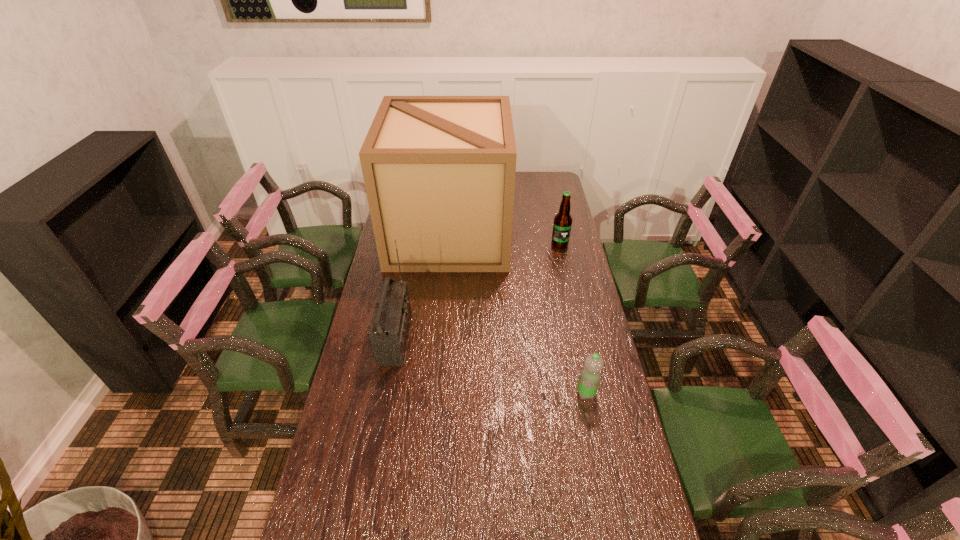
Locate an element on the screen. This screenshot has height=540, width=960. box is located at coordinates (439, 171).

Find the location of a particular element. Image resolution: width=960 pixels, height=540 pixels. the third shortest object is located at coordinates (389, 328).

Where is `radio receiver`? radio receiver is located at coordinates (389, 328).

Locate an element on the screen. This screenshot has width=960, height=540. the third tallest object is located at coordinates (562, 224).

Where is `the shortest object`? the shortest object is located at coordinates (590, 375).

Where is `the nearest object`? the nearest object is located at coordinates (x=590, y=375).

The height and width of the screenshot is (540, 960). I want to click on free space located 0.110m on the reinforced sides of the box, so click(531, 234).

Image resolution: width=960 pixels, height=540 pixels. Find the location of `vacant space located 0.310m on the front panel of the second tallest object`. vacant space located 0.310m on the front panel of the second tallest object is located at coordinates (497, 339).

At what (x,y) coordinates should I click in order to perform the action: click on blank space located 0.050m on the label of the beer bottle. Please return your answer as a coordinate pair (x, y). Looking at the image, I should click on (563, 257).

The image size is (960, 540). What are the coordinates of `vacant space located 0.100m on the back of the nearest object` in the screenshot? It's located at (579, 360).